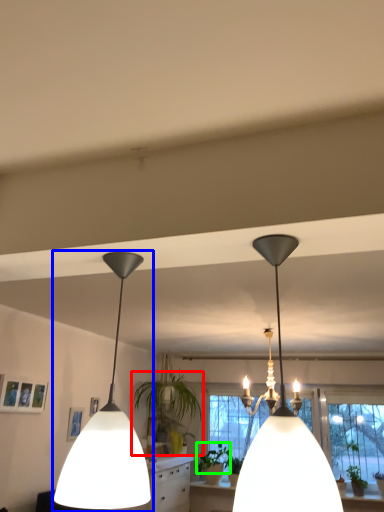
Question: Estimate the real-world distances between objects in this image. Which object is farther from houseplant (highlighted by a red box), lamp (highlighted by a blue box) or plant (highlighted by a green box)?

Choices:
 (A) lamp
 (B) plant

Answer: (A)